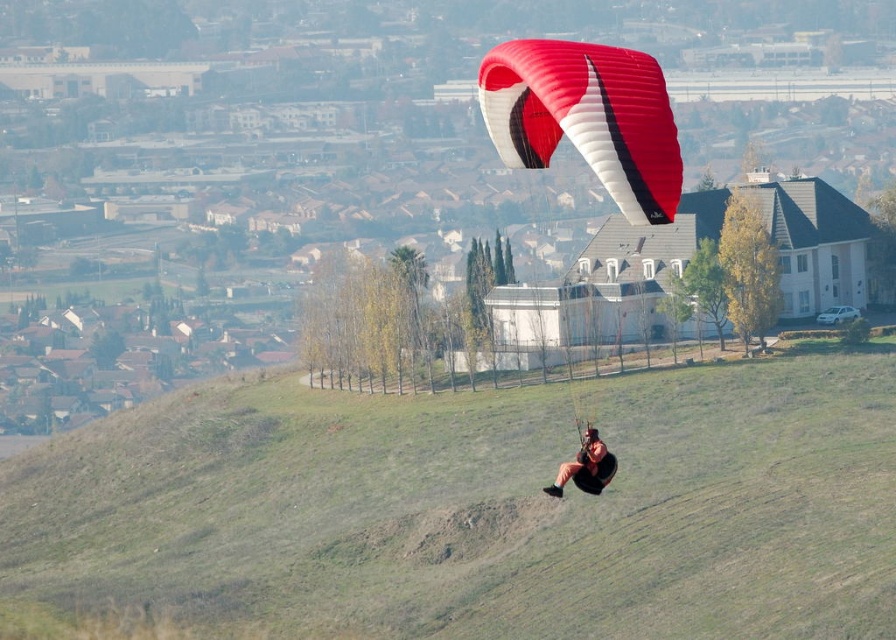
Question: Can you confirm if green grassy hillside at center is positioned to the right of red/white parachute at center?

Choices:
 (A) no
 (B) yes

Answer: (A)

Question: Can you confirm if green grassy hillside at center is positioned below red/white parachute at center?

Choices:
 (A) no
 (B) yes

Answer: (B)

Question: Which of the following is the closest to the observer?

Choices:
 (A) (188, 445)
 (B) (592, 461)
 (C) (573, 84)

Answer: (C)

Question: Which point appears farthest from the camera in this image?

Choices:
 (A) click(573, 557)
 (B) click(492, 109)
 (C) click(591, 449)

Answer: (A)

Question: Which point is farther to the camera?

Choices:
 (A) (584, 129)
 (B) (578, 452)

Answer: (B)

Question: Can you confirm if green grassy hillside at center is positioned above matte black harness at center?

Choices:
 (A) yes
 (B) no

Answer: (B)